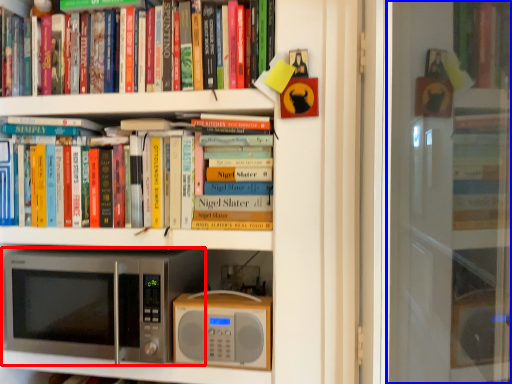
Question: Among these objects, which one is farthest to the camera, microwave oven (highlighted by a red box) or screen door (highlighted by a blue box)?

Choices:
 (A) microwave oven
 (B) screen door

Answer: (A)